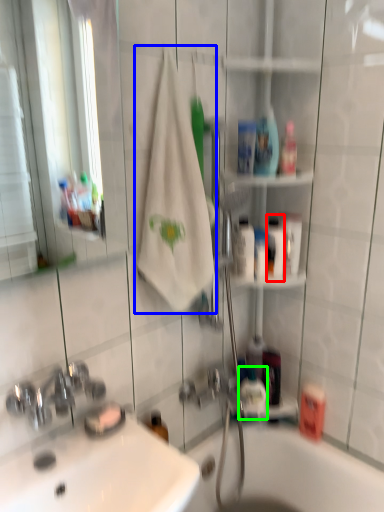
Question: Based on their relative distances, which object is nearer to mouthwash (highlighted by a red box)? Choose from bath towel (highlighted by a blue box) and mouthwash (highlighted by a green box).

Choices:
 (A) bath towel
 (B) mouthwash

Answer: (A)